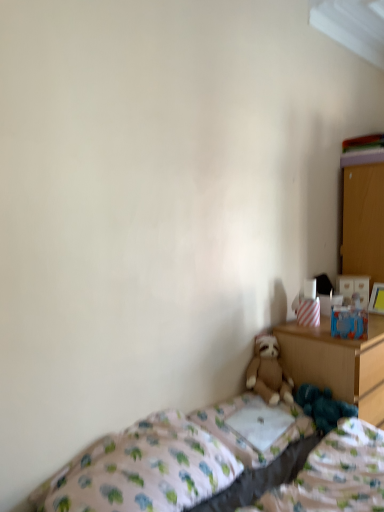
Question: Is wooden nightstand at right touching brown plush teddy bear at lower center?

Choices:
 (A) no
 (B) yes

Answer: (A)

Question: Considering the relative sizes of wooden nightstand at right and brown plush teddy bear at lower center in the image provided, is wooden nightstand at right bigger than brown plush teddy bear at lower center?

Choices:
 (A) no
 (B) yes

Answer: (B)

Question: Is wooden nightstand at right wider than brown plush teddy bear at lower center?

Choices:
 (A) no
 (B) yes

Answer: (B)

Question: Is wooden nightstand at right positioned with its back to brown plush teddy bear at lower center?

Choices:
 (A) yes
 (B) no

Answer: (B)

Question: Can you confirm if wooden nightstand at right is thinner than brown plush teddy bear at lower center?

Choices:
 (A) yes
 (B) no

Answer: (B)

Question: Can you confirm if wooden nightstand at right is smaller than brown plush teddy bear at lower center?

Choices:
 (A) yes
 (B) no

Answer: (B)

Question: From the image's perspective, is patterned fabric bed at lower right above white fabric pillow at center?

Choices:
 (A) yes
 (B) no

Answer: (A)

Question: Is white fabric pillow at center completely or partially inside patterned fabric bed at lower right?

Choices:
 (A) yes
 (B) no

Answer: (B)

Question: Is patterned fabric bed at lower right turned away from white fabric pillow at center?

Choices:
 (A) no
 (B) yes

Answer: (A)

Question: From a real-world perspective, is patterned fabric bed at lower right under white fabric pillow at center?

Choices:
 (A) yes
 (B) no

Answer: (B)

Question: Does patterned fabric bed at lower right have a smaller size compared to white fabric pillow at center?

Choices:
 (A) no
 (B) yes

Answer: (A)

Question: Considering the relative positions of patterned fabric bed at lower right and white fabric pillow at center in the image provided, is patterned fabric bed at lower right to the right of white fabric pillow at center from the viewer's perspective?

Choices:
 (A) yes
 (B) no

Answer: (B)

Question: Does patterned fabric bed at lower right appear on the left side of wooden dresser at right?

Choices:
 (A) yes
 (B) no

Answer: (A)